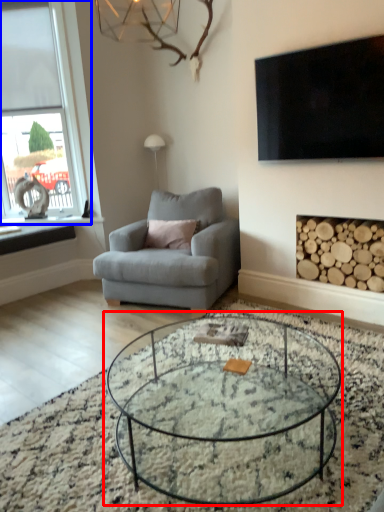
Question: Which object is further to the camera taking this photo, coffee table (highlighted by a red box) or window (highlighted by a blue box)?

Choices:
 (A) coffee table
 (B) window

Answer: (B)